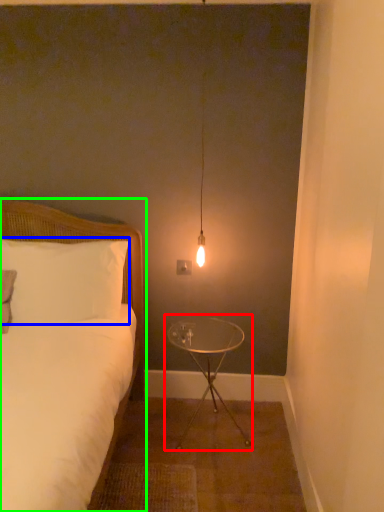
Question: Which object is positioned farthest from table (highlighted by a red box)? Select from pillow (highlighted by a blue box) and bed (highlighted by a green box).

Choices:
 (A) pillow
 (B) bed

Answer: (A)